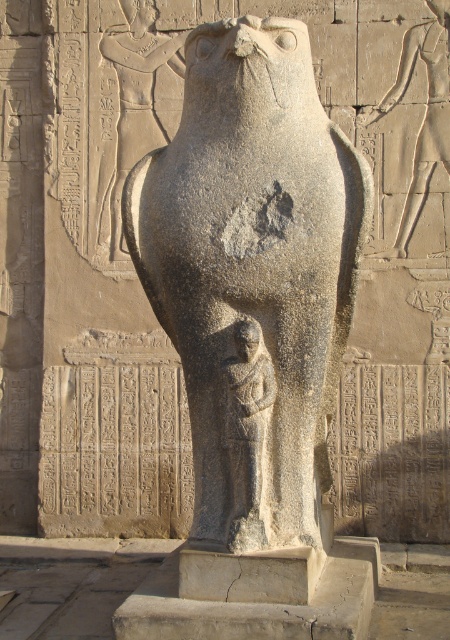
Is gray stone bird at center behind gray stone figure at center?

Yes, it is.

Who is lower down, gray stone bird at center or gray stone figure at center?

gray stone figure at center is lower down.

You are a GUI agent. You are given a task and a screenshot of the screen. Output one action in this format:
    pyautogui.click(x=<x>, y=<y>)
    Task: Click on the gray stone bird at center
    The image size is (450, 640).
    Given the screenshot: What is the action you would take?
    pyautogui.click(x=252, y=275)